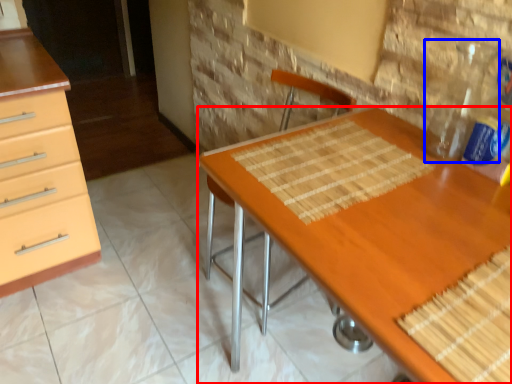
Question: Among these objects, which one is nearest to the camera, desk (highlighted by a red box) or bottle (highlighted by a blue box)?

Choices:
 (A) desk
 (B) bottle

Answer: (A)